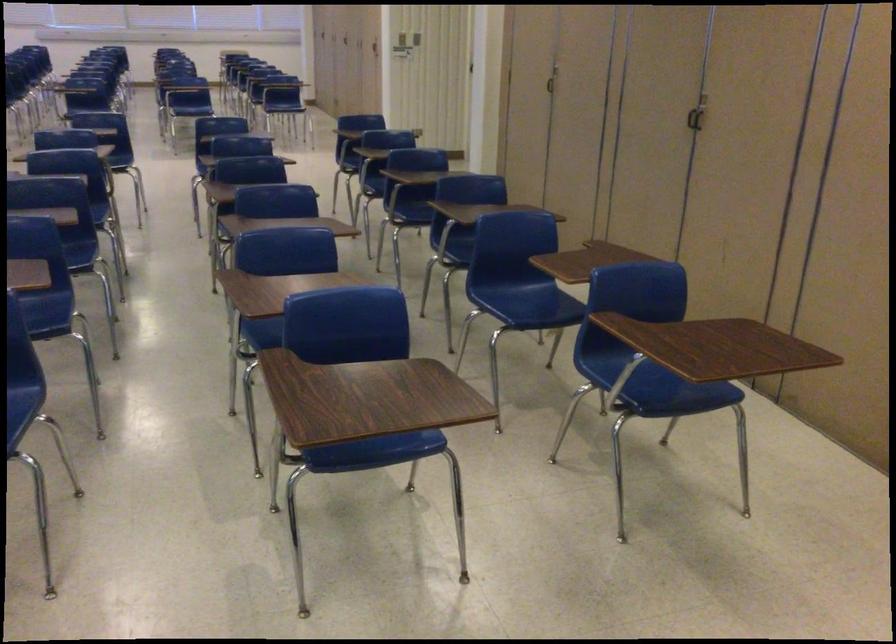
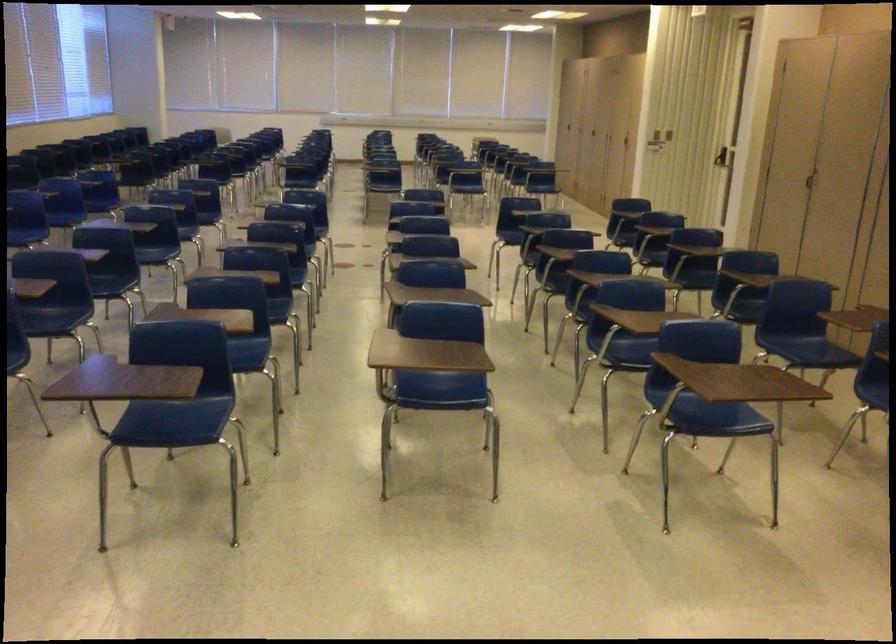
Which direction would the cameraman need to move to produce the second image?

The cameraman moved toward left, backward.